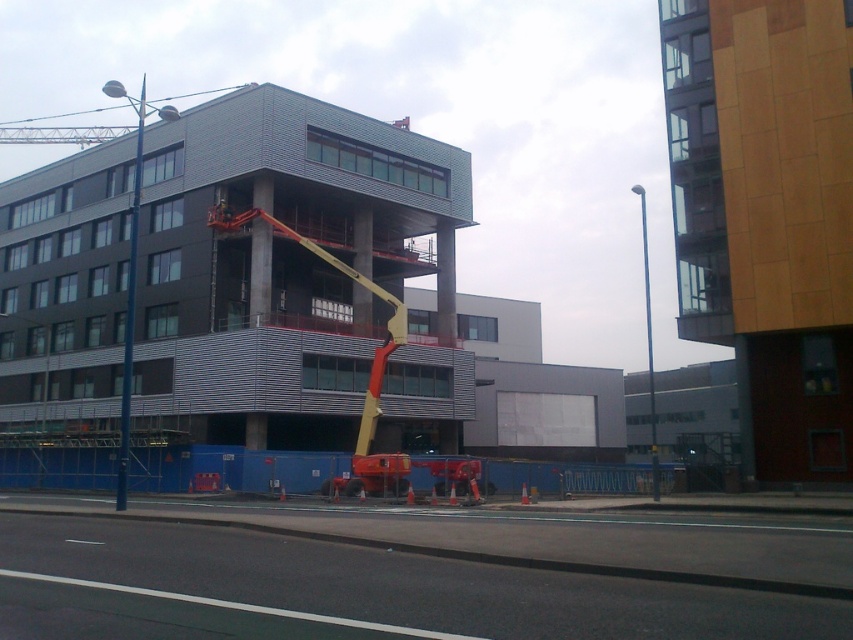
Question: Which point appears closest to the camera in this image?

Choices:
 (A) (648, 348)
 (B) (132, 228)
 (C) (221, 205)
 (D) (102, 141)

Answer: (B)

Question: Observing the image, what is the correct spatial positioning of blue metallic pole at left in reference to metallic yellow crane at upper center?

Choices:
 (A) right
 (B) left

Answer: (A)

Question: Is blue metallic pole at left closer to camera compared to smooth metallic pole at center?

Choices:
 (A) yes
 (B) no

Answer: (A)

Question: Which object is farther from the camera taking this photo?

Choices:
 (A) yellow fabric construction worker at center
 (B) smooth metallic pole at center
 (C) blue metallic pole at left

Answer: (A)

Question: Does metallic yellow crane at upper center have a lesser width compared to smooth metallic pole at center?

Choices:
 (A) yes
 (B) no

Answer: (B)

Question: Which object appears closest to the camera in this image?

Choices:
 (A) smooth metallic pole at center
 (B) blue metallic pole at left
 (C) metallic yellow crane at upper center
 (D) yellow fabric construction worker at center

Answer: (B)